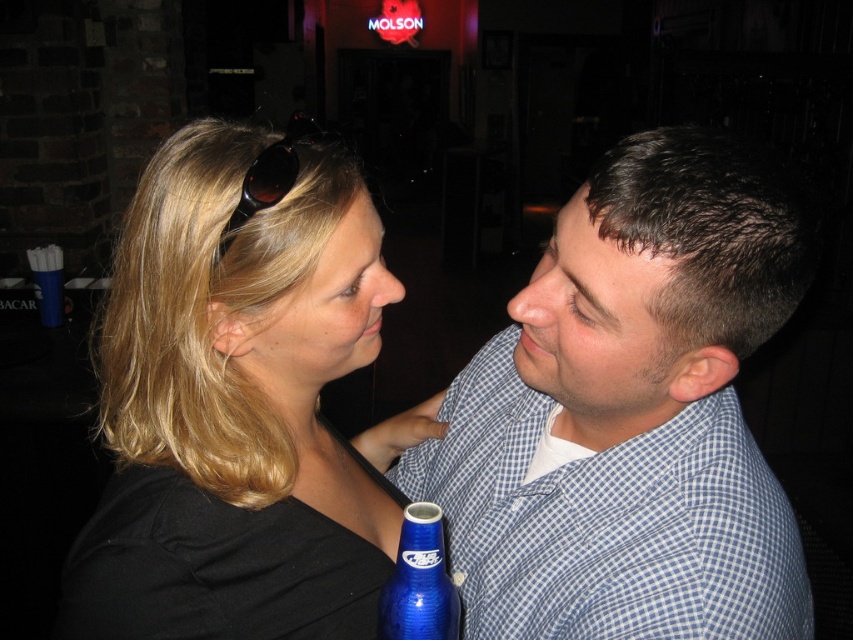
Who is positioned more to the right, blue checkered shirt at right or matte blonde hair at center?

Positioned to the right is blue checkered shirt at right.

Is blue checkered shirt at right to the right of matte blonde hair at center from the viewer's perspective?

Indeed, blue checkered shirt at right is positioned on the right side of matte blonde hair at center.

Who is more forward, (608, 312) or (369, 209)?

Point (608, 312) is more forward.

Locate an element on the screen. The width and height of the screenshot is (853, 640). blue checkered shirt at right is located at coordinates (631, 412).

Is the position of dark brown hair at upper center more distant than that of black plastic sunglasses at upper center?

That is False.

Consider the image. Between dark brown hair at upper center and black plastic sunglasses at upper center, which one appears on the left side from the viewer's perspective?

black plastic sunglasses at upper center

Who is more forward, (643, 253) or (276, 163)?

Positioned in front is point (643, 253).

At what (x,y) coordinates should I click in order to perform the action: click on dark brown hair at upper center. Please return your answer as a coordinate pair (x, y). Looking at the image, I should click on (601, 257).

Can you confirm if blue checkered shirt at right is positioned to the right of black matte hair at center?

Indeed, blue checkered shirt at right is positioned on the right side of black matte hair at center.

Is point (544, 588) farther from camera compared to point (264, 339)?

Yes, it is behind point (264, 339).

I want to click on blue checkered shirt at right, so click(x=631, y=412).